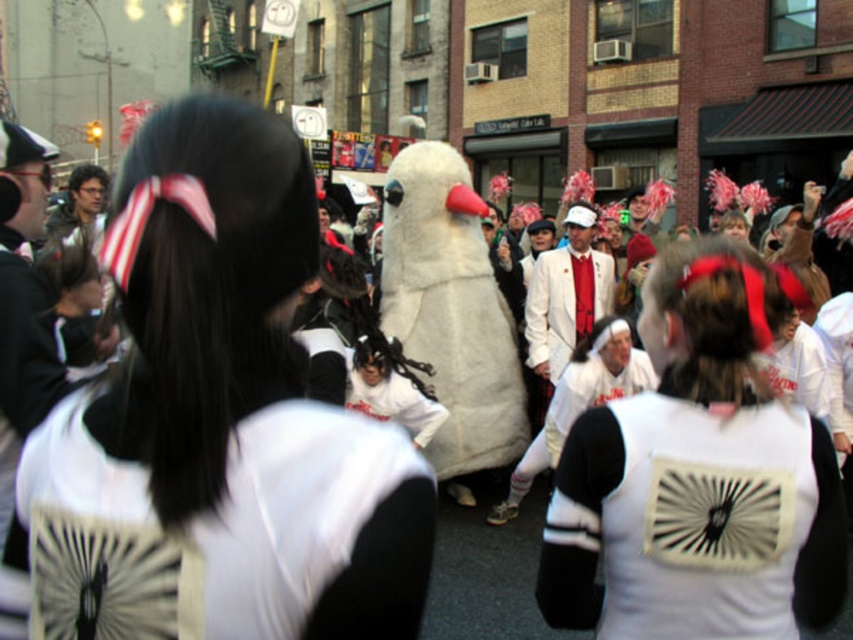
Is white matte fan at center to the right of white matte jersey at center from the viewer's perspective?

No, white matte fan at center is not to the right of white matte jersey at center.

Measure the distance from white matte fan at center to white matte jersey at center.

white matte fan at center is 1.49 meters away from white matte jersey at center.

Find the location of a particular element. white matte fan at center is located at coordinates (223, 534).

This screenshot has height=640, width=853. I want to click on white matte fan at center, so [x=223, y=534].

Which is more to the left, white matte fan at center or white matte suit at center?

From the viewer's perspective, white matte fan at center appears more on the left side.

From the picture: Is white matte fan at center smaller than white matte suit at center?

Yes.

What are the coordinates of `white matte fan at center` in the screenshot? It's located at (223, 534).

Can you confirm if white matte jersey at center is shorter than white matte suit at center?

Indeed, white matte jersey at center has a lesser height compared to white matte suit at center.

Can you confirm if white matte jersey at center is positioned to the left of white matte suit at center?

Indeed, white matte jersey at center is positioned on the left side of white matte suit at center.

Which is behind, point (770, 540) or point (596, 317)?

Point (596, 317)

What are the coordinates of `white matte jersey at center` in the screenshot? It's located at (694, 520).